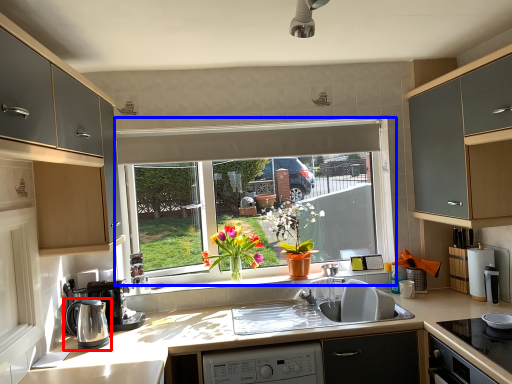
Question: Among these objects, which one is farthest to the camera, kitchen appliance (highlighted by a red box) or window (highlighted by a blue box)?

Choices:
 (A) kitchen appliance
 (B) window

Answer: (B)